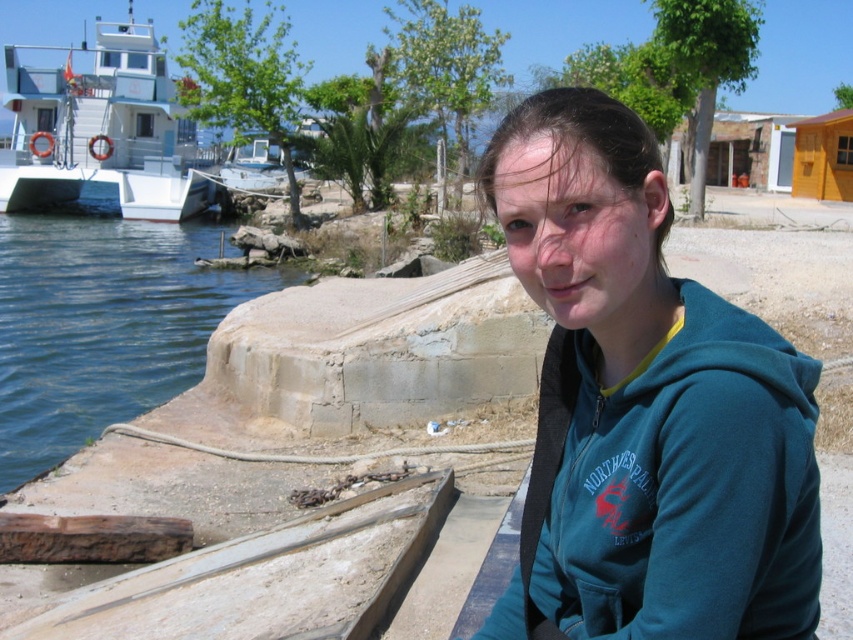
You are a photographer standing on the wooden dock where the person is sitting. You want to capture a photo that includes both the blue water at lower left and the white glossy boat at upper left. Based on their positions, where should you position your camera to ensure both elements are in the frame?

To include both the blue water at lower left and the white glossy boat at upper left in the photo, position your camera so it faces upward from the blue water at lower left towards the white glossy boat at upper left, as the blue water at lower left is located below the white glossy boat at upper left.

You are standing on the dock where the person in the teal hoodie is sitting. You see two points marked on the water surface. The first point is at coordinates point (744, 353) and the second point is at point (67, 406). If you want to throw a small floating object towards the second point, which direction should you aim relative to the first point?

Since point (744, 353) is in front of point (67, 406), you should aim behind the first point to reach the second point.

You are standing on the dock and want to throw a small pebble into the blue water at lower left. The teal fleece jacket at center is in your way. Can you still reach the water without moving the jacket?

The teal fleece jacket at center is 17.98 meters away from blue water at lower left. Since the jacket is 17.98 meters away, it is not blocking the path to the water, so you can throw the pebble into the blue water at lower left without moving the jacket.